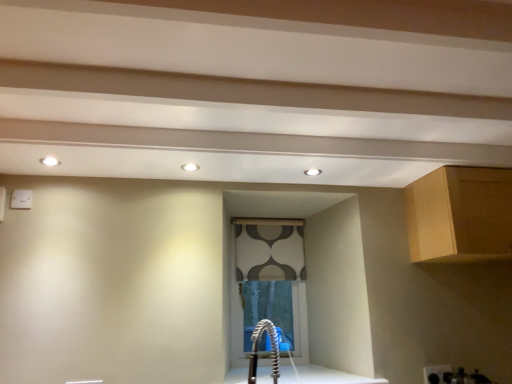
Question: Is patterned fabric window at center far away from white glossy countertop at center?

Choices:
 (A) yes
 (B) no

Answer: (B)

Question: Are patterned fabric window at center and white glossy countertop at center beside each other?

Choices:
 (A) no
 (B) yes

Answer: (A)

Question: Does patterned fabric window at center have a larger size compared to white glossy countertop at center?

Choices:
 (A) no
 (B) yes

Answer: (B)

Question: Does patterned fabric window at center have a lesser height compared to white glossy countertop at center?

Choices:
 (A) yes
 (B) no

Answer: (B)

Question: Is patterned fabric window at center turned away from white glossy countertop at center?

Choices:
 (A) yes
 (B) no

Answer: (B)

Question: Is white glossy countertop at center surrounded by patterned fabric window at center?

Choices:
 (A) yes
 (B) no

Answer: (B)

Question: Would you say white glossy countertop at center is part of light brown wood cabinet at upper right's contents?

Choices:
 (A) yes
 (B) no

Answer: (B)

Question: Can you confirm if light brown wood cabinet at upper right is bigger than white glossy countertop at center?

Choices:
 (A) no
 (B) yes

Answer: (B)

Question: Can you confirm if light brown wood cabinet at upper right is smaller than white glossy countertop at center?

Choices:
 (A) no
 (B) yes

Answer: (A)

Question: Is the depth of light brown wood cabinet at upper right less than that of white glossy countertop at center?

Choices:
 (A) no
 (B) yes

Answer: (B)

Question: Does light brown wood cabinet at upper right have a greater width compared to white glossy countertop at center?

Choices:
 (A) yes
 (B) no

Answer: (B)

Question: Is light brown wood cabinet at upper right not close to white glossy countertop at center?

Choices:
 (A) yes
 (B) no

Answer: (B)

Question: From the image's perspective, is white glossy countertop at center beneath patterned fabric window at center?

Choices:
 (A) yes
 (B) no

Answer: (A)